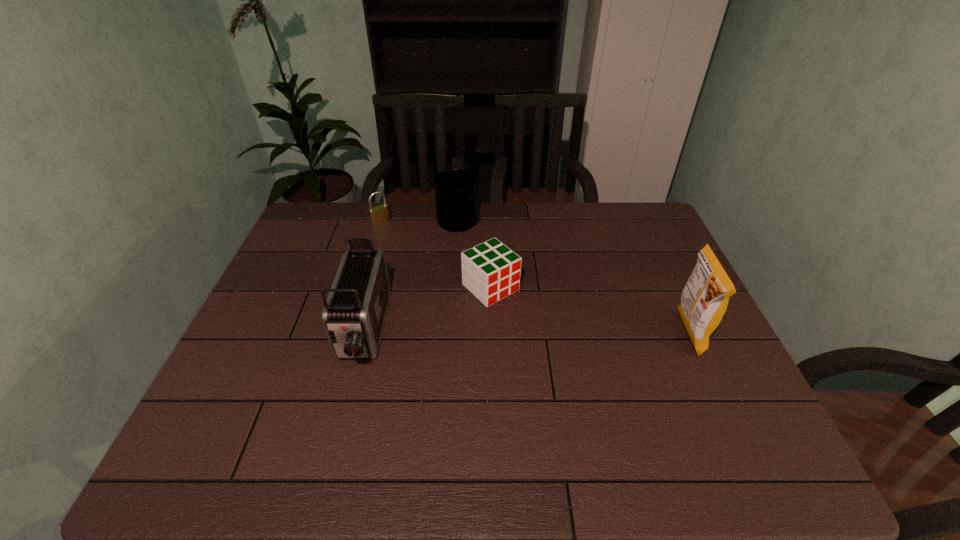
Identify the location of camcorder. Image resolution: width=960 pixels, height=540 pixels. (353, 316).

What are the coordinates of `crisp (potato chip)` in the screenshot? It's located at (704, 299).

The width and height of the screenshot is (960, 540). Identify the location of padlock. (380, 214).

Locate an element on the screen. cube is located at coordinates (491, 271).

Image resolution: width=960 pixels, height=540 pixels. Identify the location of the third shortest object. [x=455, y=189].

Locate an element on the screen. vacant space located at the lens of the camcorder is located at coordinates (340, 421).

Find the location of a particular element. The image size is (960, 540). free space located 0.330m on the front-facing side of the padlock is located at coordinates (441, 276).

Find the location of `vacant area situated 0.270m on the front-facing side of the padlock`. vacant area situated 0.270m on the front-facing side of the padlock is located at coordinates (429, 266).

You are a GUI agent. You are given a task and a screenshot of the screen. Output one action in this format:
    pyautogui.click(x=<x>, y=<y>)
    Task: Click on the free spot located on the front-facing side of the padlock
    This screenshot has width=960, height=540.
    Given the screenshot: What is the action you would take?
    pyautogui.click(x=441, y=276)

Identify the location of free location located on the red face of the cube. Image resolution: width=960 pixels, height=540 pixels. pyautogui.click(x=574, y=362).